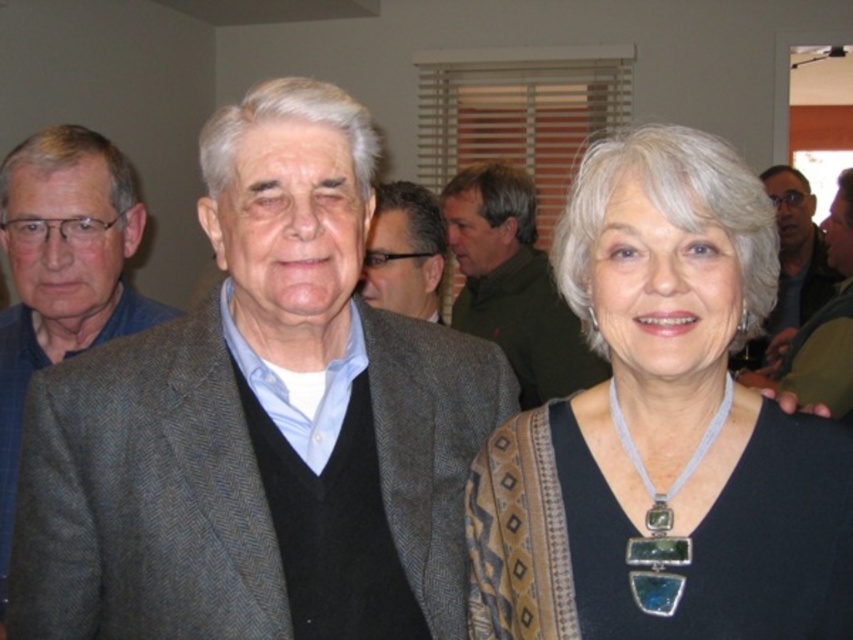
Question: Is green wool sweater at center to the left of dark brown textured jacket at center from the viewer's perspective?

Choices:
 (A) no
 (B) yes

Answer: (A)

Question: Which point appears farthest from the camera in this image?

Choices:
 (A) (804, 234)
 (B) (383, 256)
 (C) (258, 525)

Answer: (A)

Question: Is gray wool jacket at left to the left of matte black sweater at center from the viewer's perspective?

Choices:
 (A) yes
 (B) no

Answer: (A)

Question: Which object is closer to the camera taking this photo?

Choices:
 (A) green wool sweater at center
 (B) black fabric at center

Answer: (B)

Question: Estimate the real-world distances between objects in this image. Which object is farther from the gray woolen suit at center?

Choices:
 (A) black fabric at center
 (B) green wool sweater at center

Answer: (B)

Question: Does gray woolen suit at center appear on the right side of matte black sweater at center?

Choices:
 (A) no
 (B) yes

Answer: (A)